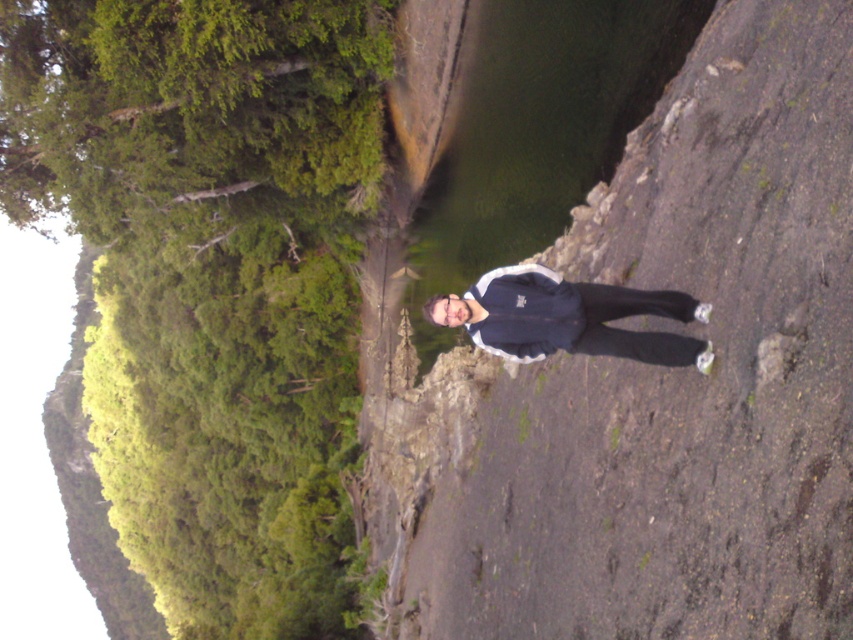
Is dull gray rock at center shorter than dark blue fabric jacket at center?

In fact, dull gray rock at center may be taller than dark blue fabric jacket at center.

Which is in front, point (476, 435) or point (563, 304)?

Point (563, 304)

Find the location of a particular element. Image resolution: width=853 pixels, height=640 pixels. dull gray rock at center is located at coordinates (659, 385).

Find the location of a particular element. The height and width of the screenshot is (640, 853). dull gray rock at center is located at coordinates (659, 385).